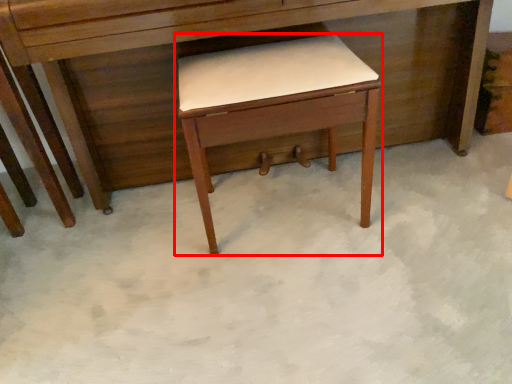
Question: From the image, what is the correct spatial relationship of table (annotated by the red box) in relation to desk?

Choices:
 (A) right
 (B) left

Answer: (A)